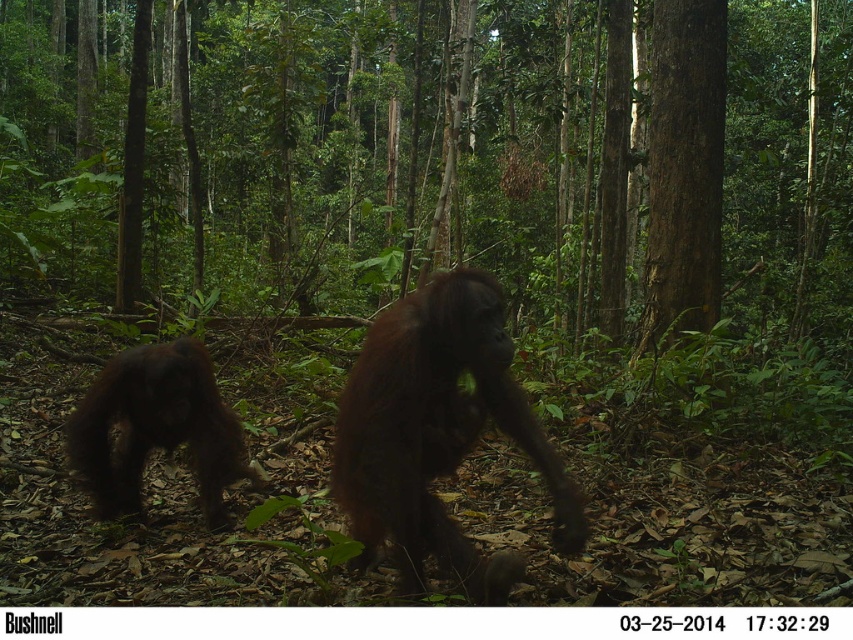
Between brown rough bark tree at right and brown furry orangutan at left, which one appears on the right side from the viewer's perspective?

From the viewer's perspective, brown rough bark tree at right appears more on the right side.

Which is more to the left, brown rough bark tree at right or brown furry orangutan at left?

brown furry orangutan at left

Between point (709, 97) and point (144, 374), which one is positioned in front?

Point (144, 374) is more forward.

This screenshot has width=853, height=640. Identify the location of brown rough bark tree at right. (683, 168).

Who is more distant from viewer, (468, 339) or (142, 440)?

The point (142, 440) is more distant.

Can you confirm if brown furry orangutan at center is shorter than brown furry orangutan at left?

No, brown furry orangutan at center is not shorter than brown furry orangutan at left.

Is point (379, 444) positioned in front of point (94, 396)?

Yes, point (379, 444) is in front of point (94, 396).

Locate an element on the screen. brown furry orangutan at center is located at coordinates (437, 433).

Can you confirm if brown furry orangutan at center is positioned above brown rough bark tree at right?

Actually, brown furry orangutan at center is below brown rough bark tree at right.

Does brown furry orangutan at center appear on the right side of brown rough bark tree at right?

No, brown furry orangutan at center is not to the right of brown rough bark tree at right.

Image resolution: width=853 pixels, height=640 pixels. What are the coordinates of `brown furry orangutan at center` in the screenshot? It's located at [x=437, y=433].